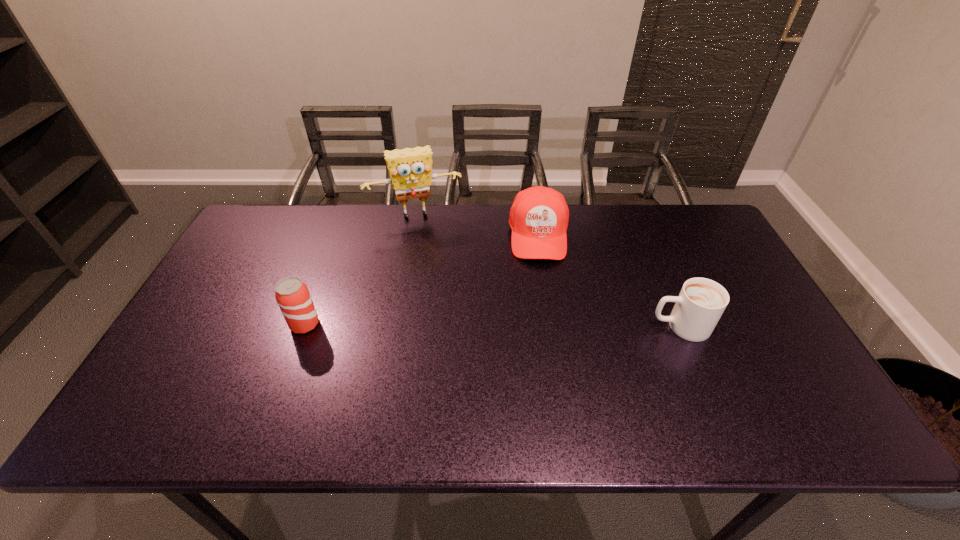
Locate an element on the screen. The height and width of the screenshot is (540, 960). free space at the right edge of the desktop is located at coordinates (782, 346).

Find the location of `vacant space at the far left corner of the desktop`. vacant space at the far left corner of the desktop is located at coordinates (269, 215).

At what (x,y) coordinates should I click in order to perform the action: click on free space that is in between the beer can and the second object from left to right. Please return your answer as a coordinate pair (x, y). The height and width of the screenshot is (540, 960). Looking at the image, I should click on (360, 269).

Locate an element on the screen. vacant area that lies between the beer can and the baseball cap is located at coordinates (421, 280).

At what (x,y) coordinates should I click in order to perform the action: click on vacant space that is in between the beer can and the sponge. Please return your answer as a coordinate pair (x, y). Looking at the image, I should click on pyautogui.click(x=360, y=269).

The image size is (960, 540). Identify the location of free point between the leftmost object and the third object from left to right. (421, 280).

Find the location of `free space between the leftmost object and the second object from left to right`. free space between the leftmost object and the second object from left to right is located at coordinates (360, 269).

Where is `free point between the beer can and the cappuccino`? This screenshot has width=960, height=540. free point between the beer can and the cappuccino is located at coordinates (492, 325).

Where is `free spot between the cappuccino and the beer can`? The image size is (960, 540). free spot between the cappuccino and the beer can is located at coordinates (492, 325).

At what (x,y) coordinates should I click in order to perform the action: click on free space between the tallest object and the third object from left to right. Please return your answer as a coordinate pair (x, y). Looking at the image, I should click on (477, 225).